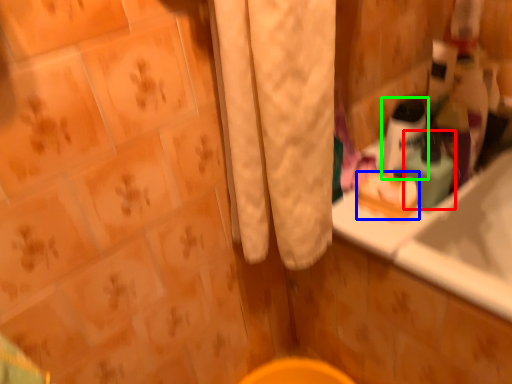
Question: Which object is the closest to the mouthwash (highlighted by a red box)? Choose among these: soap (highlighted by a blue box) or mouthwash (highlighted by a green box).

Choices:
 (A) soap
 (B) mouthwash

Answer: (B)